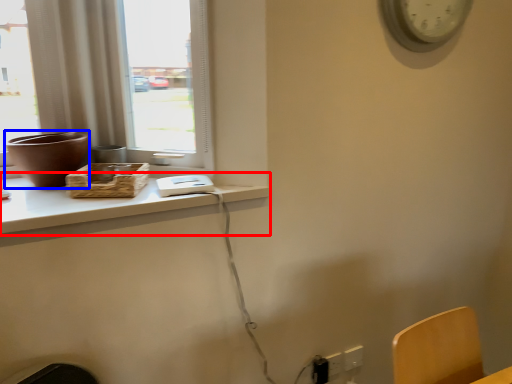
Question: Which point is further to the camera, computer desk (highlighted by a red box) or vase (highlighted by a blue box)?

Choices:
 (A) computer desk
 (B) vase

Answer: (B)